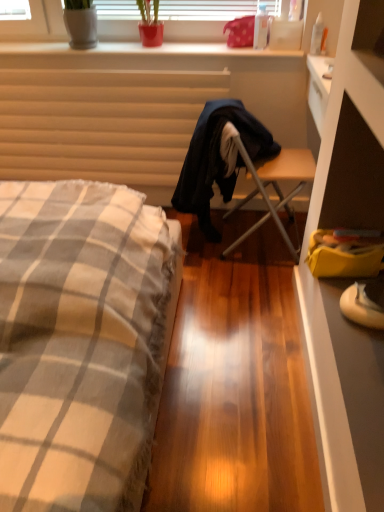
Question: Does dark blue fabric robe at center appear on the left side of transparent plastic bottle at upper right, marked as the first bottle in a right-to-left arrangement?

Choices:
 (A) no
 (B) yes

Answer: (B)

Question: From the image's perspective, is dark blue fabric robe at center located beneath transparent plastic bottle at upper right, marked as the first bottle in a right-to-left arrangement?

Choices:
 (A) no
 (B) yes

Answer: (B)

Question: Is transparent plastic bottle at upper right, positioned as the second bottle in left-to-right order, surrounded by dark blue fabric robe at center?

Choices:
 (A) no
 (B) yes

Answer: (A)

Question: Considering the relative sizes of dark blue fabric robe at center and transparent plastic bottle at upper right, positioned as the second bottle in left-to-right order, in the image provided, is dark blue fabric robe at center smaller than transparent plastic bottle at upper right, positioned as the second bottle in left-to-right order,?

Choices:
 (A) yes
 (B) no

Answer: (B)

Question: Does dark blue fabric robe at center have a greater width compared to transparent plastic bottle at upper right, positioned as the second bottle in left-to-right order?

Choices:
 (A) yes
 (B) no

Answer: (A)

Question: Does dark blue fabric robe at center appear on the right side of transparent plastic bottle at upper right, positioned as the second bottle in left-to-right order?

Choices:
 (A) yes
 (B) no

Answer: (B)

Question: Is wooden folding chair at center directly adjacent to checkered fabric bed at left?

Choices:
 (A) yes
 (B) no

Answer: (B)

Question: Is wooden folding chair at center in front of checkered fabric bed at left?

Choices:
 (A) yes
 (B) no

Answer: (B)

Question: Can you confirm if wooden folding chair at center is shorter than checkered fabric bed at left?

Choices:
 (A) no
 (B) yes

Answer: (B)

Question: From a real-world perspective, is wooden folding chair at center over checkered fabric bed at left?

Choices:
 (A) yes
 (B) no

Answer: (B)

Question: Does wooden folding chair at center come behind checkered fabric bed at left?

Choices:
 (A) no
 (B) yes

Answer: (B)

Question: Is wooden folding chair at center to the left of checkered fabric bed at left from the viewer's perspective?

Choices:
 (A) no
 (B) yes

Answer: (A)

Question: Considering the relative sizes of dark blue fabric robe at center and checkered fabric bed at left in the image provided, is dark blue fabric robe at center taller than checkered fabric bed at left?

Choices:
 (A) yes
 (B) no

Answer: (B)